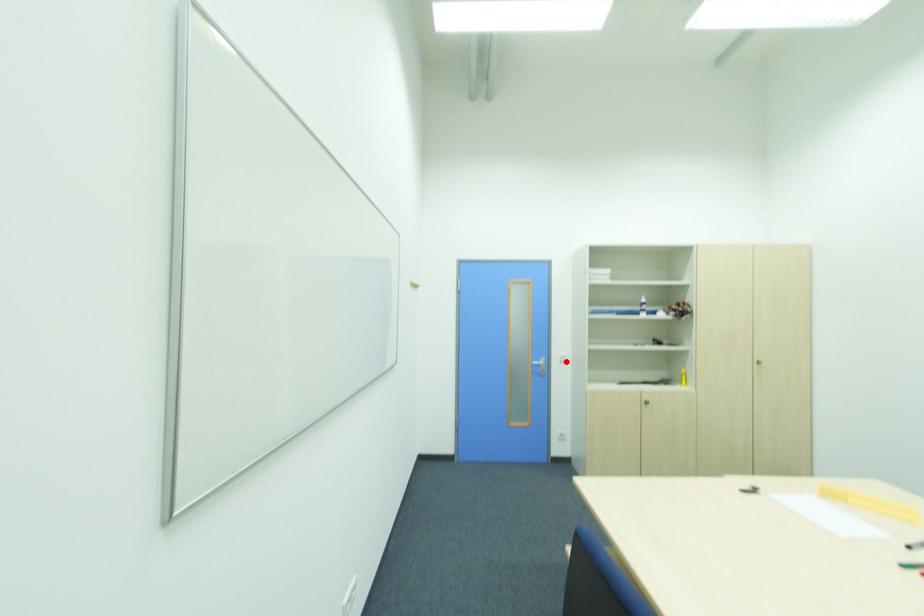
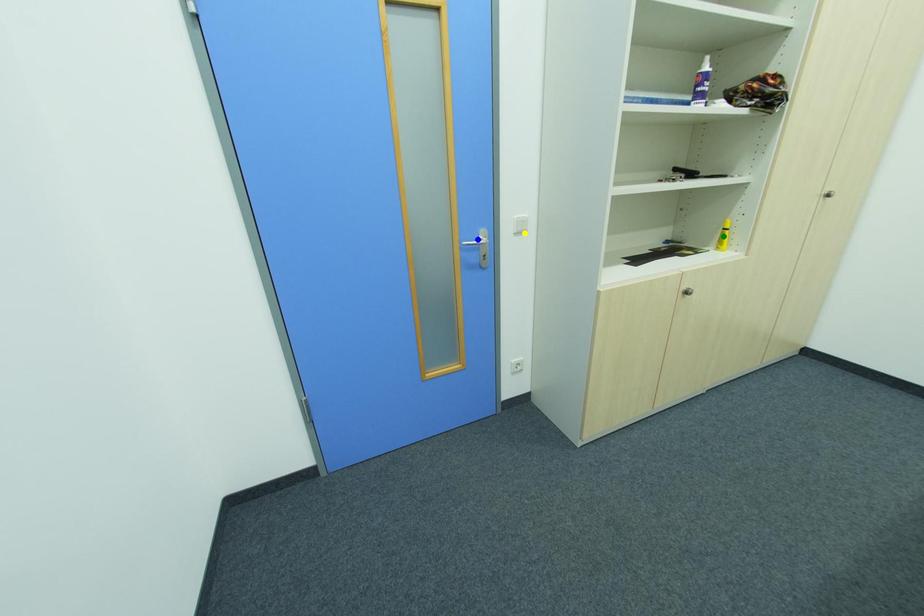
Question: I am providing you with two images of the same scene from different viewpoints. A red point is marked on the first image. You are given multiple points on the second image. Which point in image 2 is actually the same real-world point as the red point in image 1?

Choices:
 (A) yellow point
 (B) blue point
 (C) green point

Answer: (A)